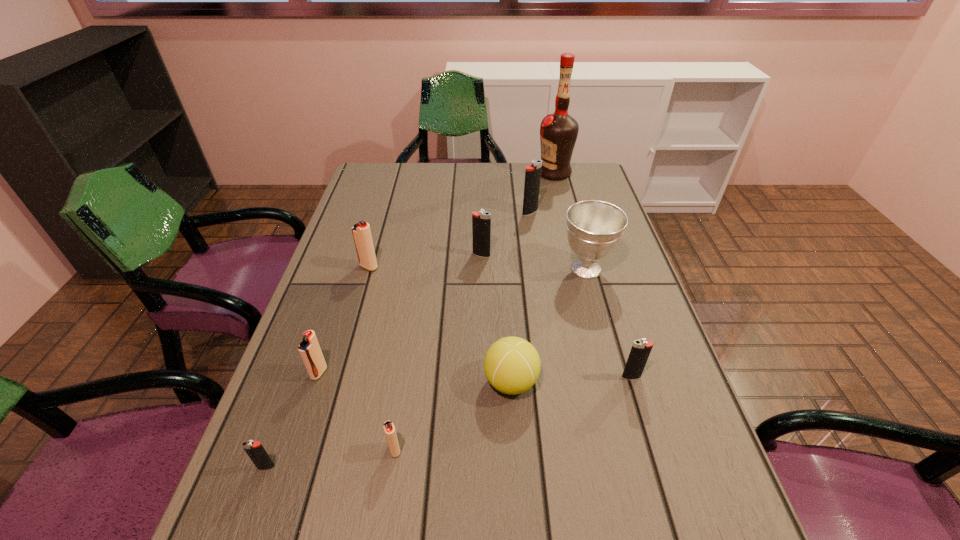
Locate an element on the screen. The height and width of the screenshot is (540, 960). object at the far edge is located at coordinates (558, 132).

Where is `liquor located in the right edge section of the desktop`? This screenshot has width=960, height=540. liquor located in the right edge section of the desktop is located at coordinates (558, 132).

In order to click on chalice at the right edge in this screenshot , I will do `click(594, 228)`.

Identify the location of igniter located at the right edge. (640, 351).

The image size is (960, 540). I want to click on object positioned at the far right corner, so click(x=558, y=132).

You are a GUI agent. You are given a task and a screenshot of the screen. Output one action in this format:
    pyautogui.click(x=<x>, y=<y>)
    Task: Click on the free location at the far edge
    This screenshot has width=960, height=540.
    Given the screenshot: What is the action you would take?
    pyautogui.click(x=502, y=163)

Where is `vacant space at the left edge of the desktop`? The width and height of the screenshot is (960, 540). vacant space at the left edge of the desktop is located at coordinates (331, 382).

The height and width of the screenshot is (540, 960). Identify the location of free point at the right edge. (593, 313).

The width and height of the screenshot is (960, 540). In order to click on empty location between the second red igniter from right to left and the tennis ball in this screenshot , I will do `click(440, 325)`.

You are a GUI agent. You are given a task and a screenshot of the screen. Output one action in this format:
    pyautogui.click(x=<x>, y=<y>)
    Task: Click on the vacant space that is in between the chalice and the green tennis ball
    
    Given the screenshot: What is the action you would take?
    pyautogui.click(x=548, y=326)